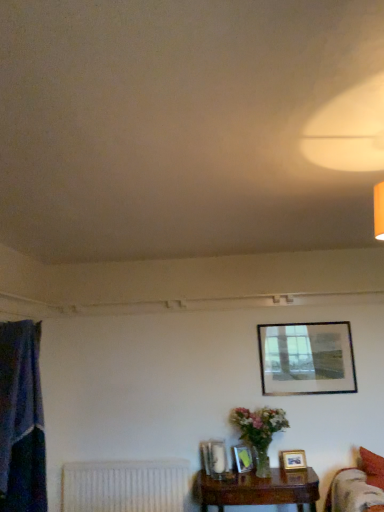
Question: Is point (21, 380) positioned closer to the camera than point (122, 466)?

Choices:
 (A) farther
 (B) closer

Answer: (B)

Question: Considering the relative positions of blue fabric curtain at left and white textured radiator at lower left in the image provided, is blue fabric curtain at left to the left or to the right of white textured radiator at lower left?

Choices:
 (A) right
 (B) left

Answer: (B)

Question: Estimate the real-world distances between objects in this image. Which object is closer to the velvet red couch at lower right?

Choices:
 (A) matte plastic picture frame at lower center, acting as the first picture frame starting from the bottom
 (B) matte glass picture frame at lower center, placed as the 4th picture frame when sorted from right to left
 (C) blue fabric curtain at left
 (D) brown wooden table at lower right
 (E) wooden photo frame at lower right, the second picture frame from the bottom

Answer: (D)

Question: Which is farther from the blue fabric curtain at left?

Choices:
 (A) matte glass picture frame at lower center, acting as the 1th picture frame starting from the left
 (B) velvet red couch at lower right
 (C) white textured radiator at lower left
 (D) matte plastic picture frame at lower center, placed as the fourth picture frame when sorted from top to bottom
 (E) wooden photo frame at lower right, positioned as the 3th picture frame in top-to-bottom order

Answer: (E)